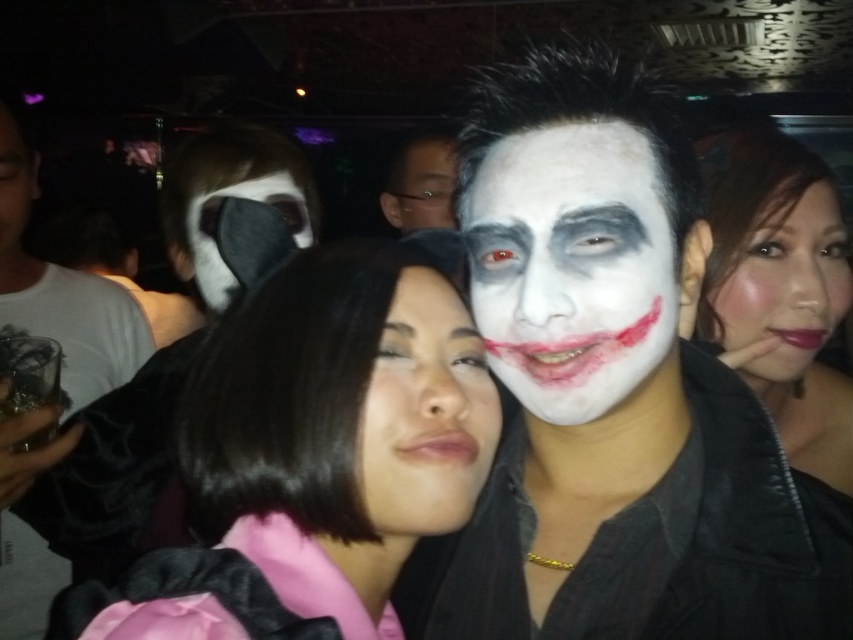
Question: Among these objects, which one is farthest from the camera?

Choices:
 (A) white matte face at center
 (B) matte white face at center
 (C) pink satin dress at center
 (D) matte black mask at center

Answer: (A)

Question: Which object is closer to the camera taking this photo?

Choices:
 (A) pink satin dress at center
 (B) white matte face at center

Answer: (A)

Question: Does matte white face at center have a greater width compared to matte black mask at center?

Choices:
 (A) yes
 (B) no

Answer: (B)

Question: Estimate the real-world distances between objects in this image. Which object is closer to the white matte face at center?

Choices:
 (A) pink satin dress at center
 (B) matte black mask at center

Answer: (B)

Question: From the image, what is the correct spatial relationship of pink satin dress at center in relation to matte white face at center?

Choices:
 (A) left
 (B) right

Answer: (A)

Question: Does white matte face paint at center have a greater width compared to matte white face at center?

Choices:
 (A) yes
 (B) no

Answer: (A)